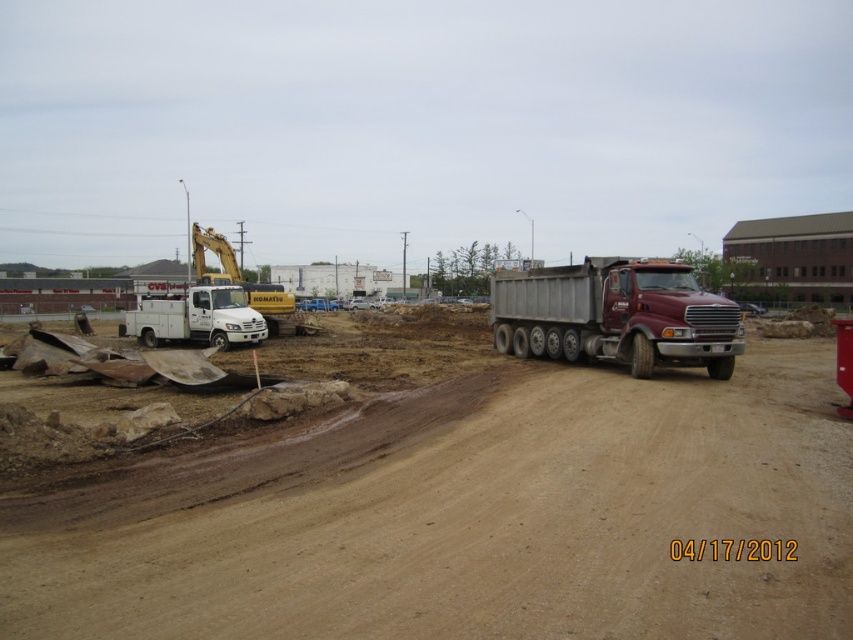
Does maroon metallic dump truck at right appear under white matte utility truck at left?

Yes, maroon metallic dump truck at right is below white matte utility truck at left.

Between point (566, 291) and point (222, 337), which one is positioned in front?

Point (566, 291)

The height and width of the screenshot is (640, 853). I want to click on maroon metallic dump truck at right, so point(614,316).